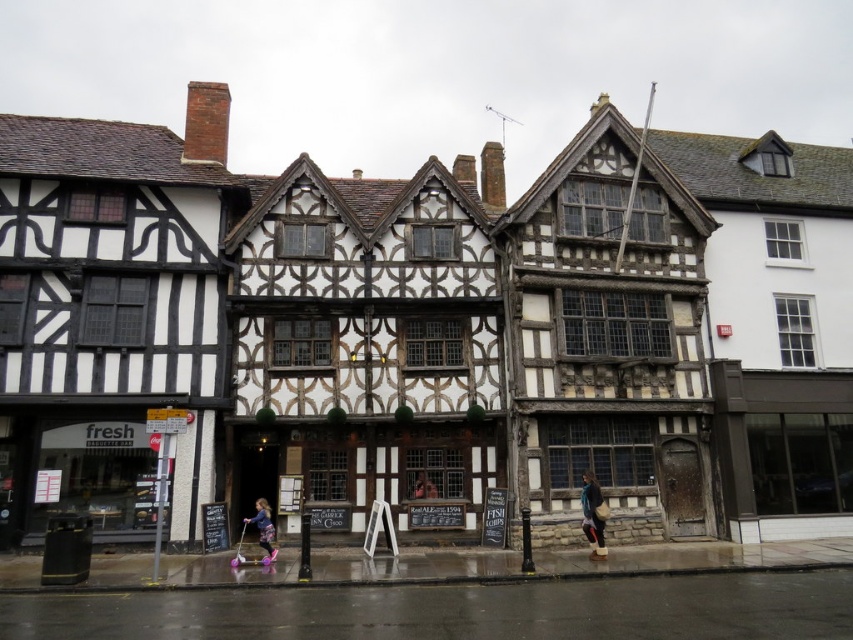
You are a customer at the bakery and see a blue denim jacket at center and a pink fabric pants at lower center hanging on a rack. Which item would you need to reach higher to pick up?

The blue denim jacket at center is bigger than pink fabric pants at lower center, so you would need to reach higher to pick up the blue denim jacket at center.